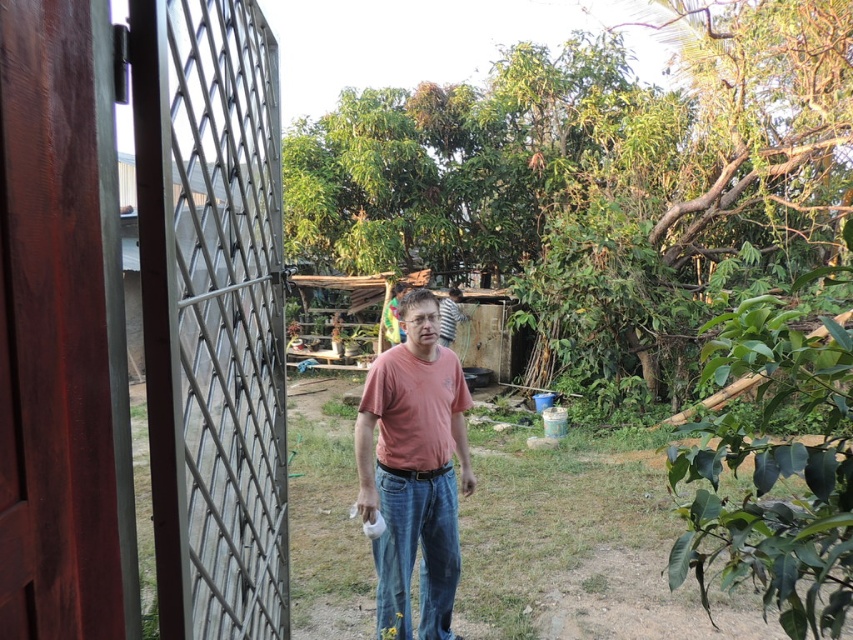
You are a delivery person holding a package that is 30 inches long. You need to pass through the brown wooden gate at left to deliver it. Can the package fit through the gate vertically?

The distance between the brown wooden gate at left and the man is 30.97 inches. Since the package is 30 inches long, it can fit vertically through the gate as it is slightly shorter than the available space.